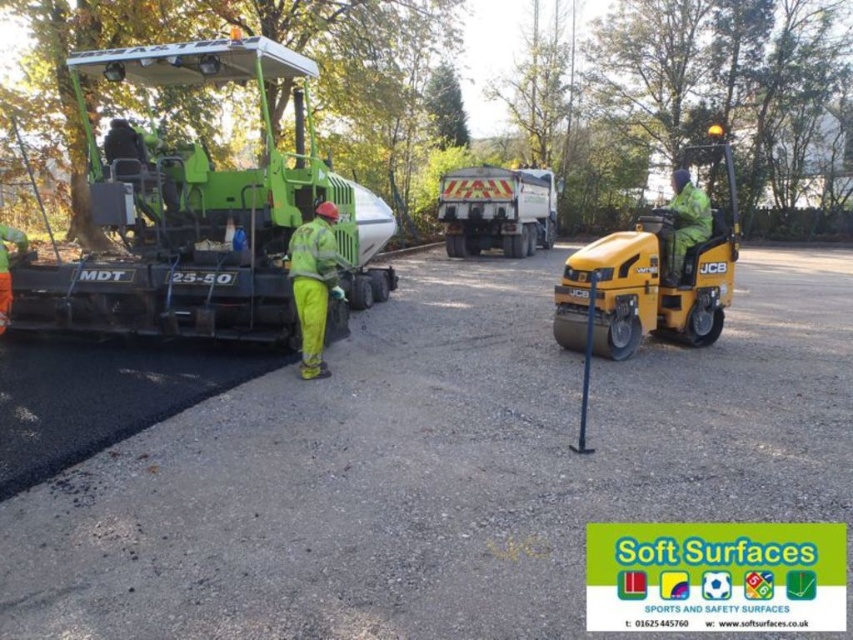
Who is positioned more to the right, yellow rubber jcb at right or yellow reflective plastic truck at center?

yellow rubber jcb at right

What do you see at coordinates (653, 273) in the screenshot? Image resolution: width=853 pixels, height=640 pixels. I see `yellow rubber jcb at right` at bounding box center [653, 273].

Find the location of a particular element. Image resolution: width=853 pixels, height=640 pixels. yellow rubber jcb at right is located at coordinates (653, 273).

Is yellow reflective plastic truck at center shorter than yellow reflective safety suit at center?

No.

Between yellow reflective plastic truck at center and yellow reflective safety suit at center, which one appears on the left side from the viewer's perspective?

yellow reflective safety suit at center is more to the left.

Where is `yellow reflective plastic truck at center`? yellow reflective plastic truck at center is located at coordinates [x=497, y=209].

Is point (99, 323) positioned behind point (325, 292)?

Yes.

Which is behind, point (279, 337) or point (316, 333)?

Point (279, 337)

What do you see at coordinates (206, 216) in the screenshot?
I see `green rubberized asphalt paver at left` at bounding box center [206, 216].

At what (x,y) coordinates should I click in order to perform the action: click on green rubberized asphalt paver at left. Please return your answer as a coordinate pair (x, y). The image size is (853, 640). Looking at the image, I should click on (206, 216).